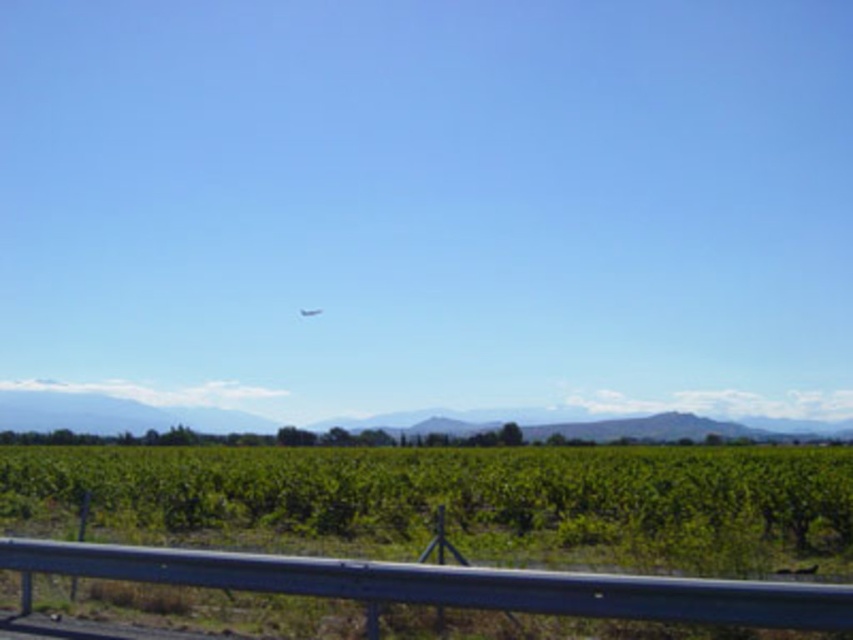
Question: Can you confirm if green leafy vineyard at lower center is wider than transparent glass plane at center?

Choices:
 (A) no
 (B) yes

Answer: (B)

Question: Does green leafy vineyard at lower center appear on the right side of transparent glass plane at center?

Choices:
 (A) no
 (B) yes

Answer: (B)

Question: Can you confirm if green leafy vineyard at lower center is positioned to the right of transparent glass plane at center?

Choices:
 (A) yes
 (B) no

Answer: (A)